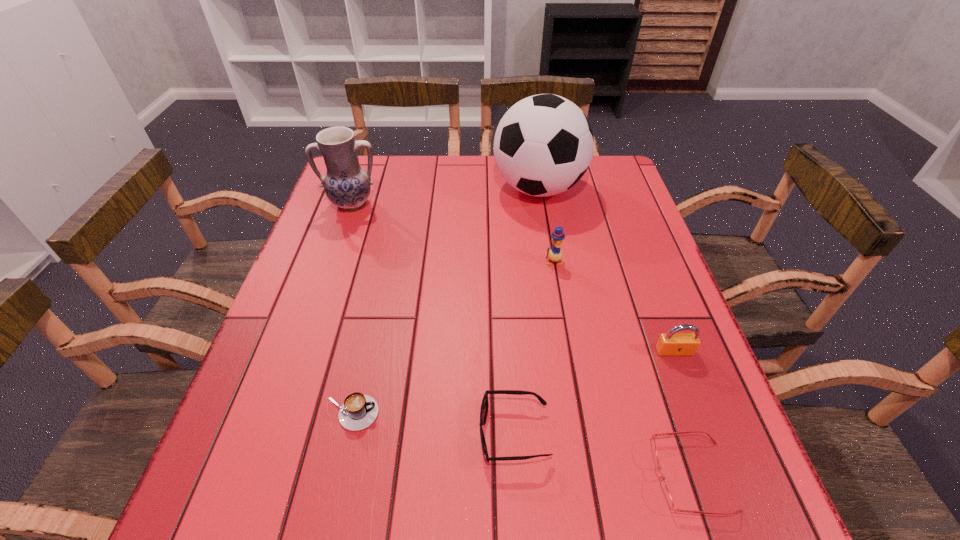
Find the location of a particular element. This screenshot has height=540, width=960. the tallest object is located at coordinates (543, 145).

Where is `the sixth shortest object`? The image size is (960, 540). the sixth shortest object is located at coordinates (347, 185).

The width and height of the screenshot is (960, 540). I want to click on the fifth nearest object, so click(x=555, y=254).

You are a GUI agent. You are given a task and a screenshot of the screen. Output one action in this format:
    pyautogui.click(x=<x>, y=<y>)
    Task: Click on the duckling
    The image size is (960, 540).
    Given the screenshot: What is the action you would take?
    pyautogui.click(x=555, y=254)

Where is `the fourth nearest object`? This screenshot has height=540, width=960. the fourth nearest object is located at coordinates (672, 343).

The image size is (960, 540). In order to click on the fourth shortest object in this screenshot , I will do `click(672, 343)`.

Where is `sunglasses`? sunglasses is located at coordinates (485, 404).

Identify the location of cappuccino. Image resolution: width=960 pixels, height=540 pixels. (359, 411).

Where is `spectacles`? spectacles is located at coordinates (666, 494).

The width and height of the screenshot is (960, 540). Identify the location of vacant space located on the left of the tallest object. (476, 188).